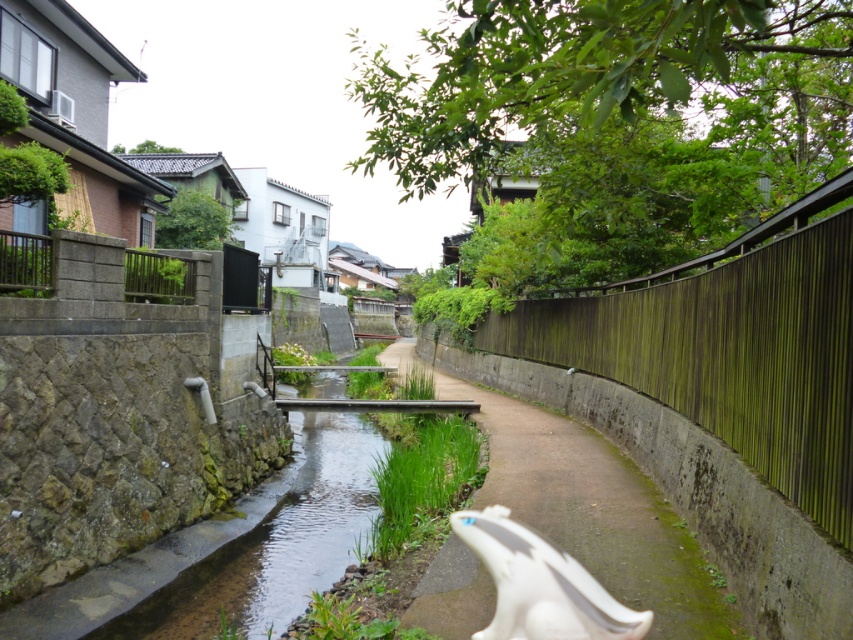
You are a delivery person with a 10 feet wide cart. You need to cross the canal via the bridge on the left. Can your cart fit through the gap between the green mossy wood fence at right and the bridge on the left?

The gap between the green mossy wood fence at right and the bridge on the left is 10.34 feet, so yes, the cart can fit through since it is wider than the cart.

You are standing at the point marked by the coordinate (x=595, y=512) in the image. Which object from the scene is exactly at your location?

The brown concrete path at center is located at point (x=595, y=512), so the object exactly at your location is the brown concrete path at center.